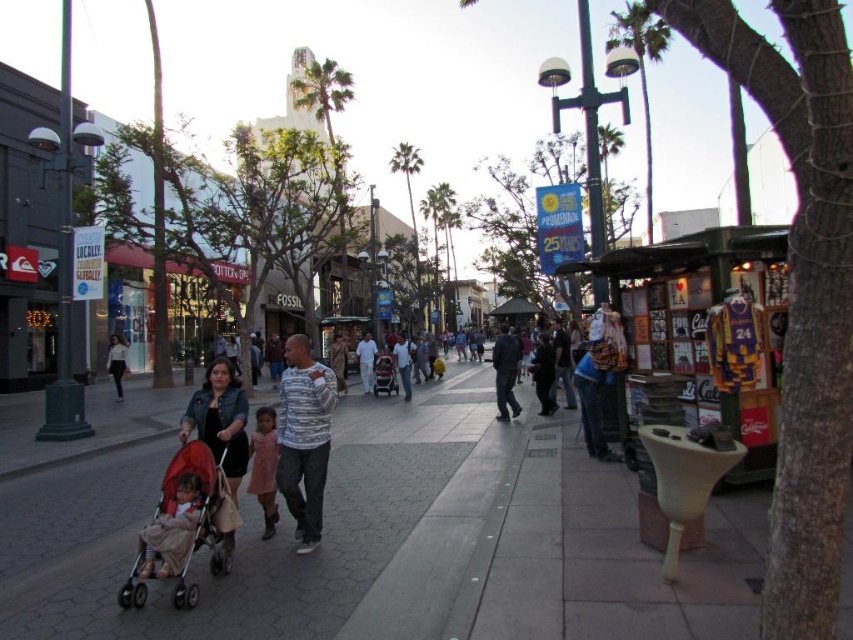
Can you confirm if striped sweater at center is wider than dark gray sweater at center?

Correct, the width of striped sweater at center exceeds that of dark gray sweater at center.

Is striped sweater at center bigger than dark gray sweater at center?

Correct, striped sweater at center is larger in size than dark gray sweater at center.

Does point (287, 429) come closer to viewer compared to point (570, 406)?

Yes, it is in front of point (570, 406).

This screenshot has width=853, height=640. Identify the location of striped sweater at center. (305, 436).

Who is taller, matte glass storefront at center or pink satin dress at center?

With more height is matte glass storefront at center.

Can you confirm if matte glass storefront at center is taller than pink satin dress at center?

Yes.

This screenshot has height=640, width=853. Identify the location of matte glass storefront at center. (26, 234).

Does point (740, 241) lie in front of point (244, 278)?

Yes, it is.

Between point (636, 326) and point (38, 221), which one is positioned behind?

The point (38, 221) is behind.

Which is in front, point (753, 248) or point (74, 189)?

Point (753, 248) is in front.

Where is `metallic silver display stand at right`? metallic silver display stand at right is located at coordinates (706, 323).